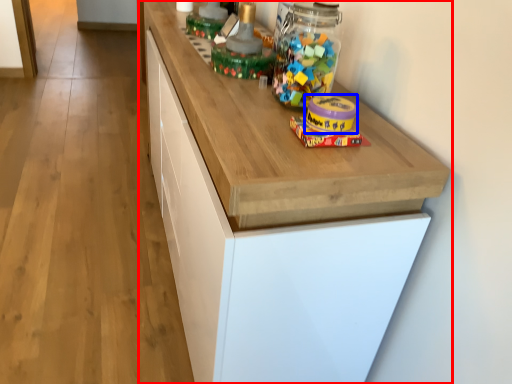
Question: Which of the following is the farthest to the observer, cabinetry (highlighted by a red box) or toy (highlighted by a blue box)?

Choices:
 (A) cabinetry
 (B) toy

Answer: (B)